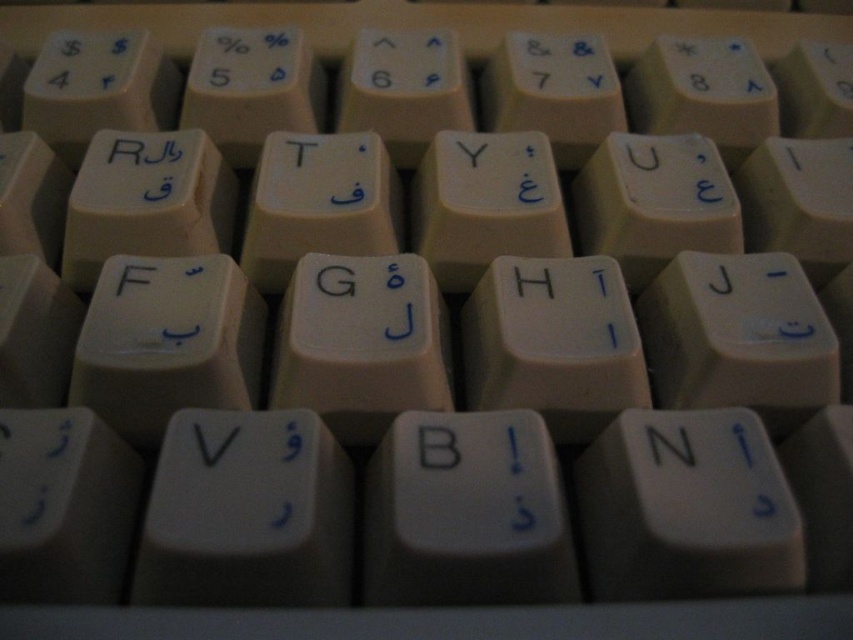
Question: Is white plastic letter g at center wider than white plastic letter f at center?

Choices:
 (A) yes
 (B) no

Answer: (A)

Question: Which object appears closest to the camera in this image?

Choices:
 (A) matte white key at upper left
 (B) white plastic letter f at center

Answer: (B)

Question: Which point is farther from the camera taking this photo?

Choices:
 (A) (399, 333)
 (B) (131, 156)
 (C) (138, 269)

Answer: (B)

Question: Which point is closer to the camera?

Choices:
 (A) (132, 150)
 (B) (239, 429)
 (C) (407, 324)
 (D) (549, 282)

Answer: (B)

Question: Is white plastic letter b at center bigger than white plastic letter j at center?

Choices:
 (A) no
 (B) yes

Answer: (A)

Question: Can you confirm if black plastic letter v at center is smaller than matte white key at upper left?

Choices:
 (A) yes
 (B) no

Answer: (A)